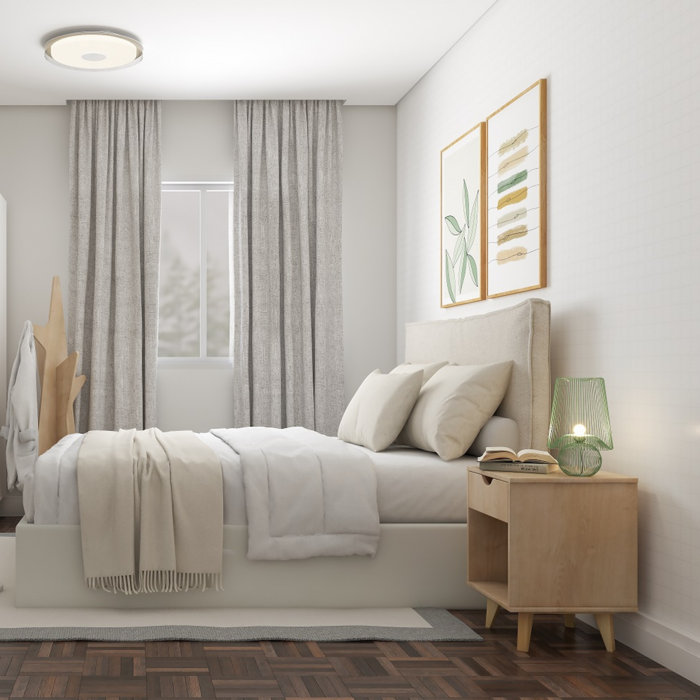
Image resolution: width=700 pixels, height=700 pixels. What are the coordinates of `3 pillows` in the screenshot? It's located at (497, 374), (456, 449), (448, 386), (414, 418), (374, 441), (411, 379), (374, 390), (346, 423), (430, 365), (402, 365).